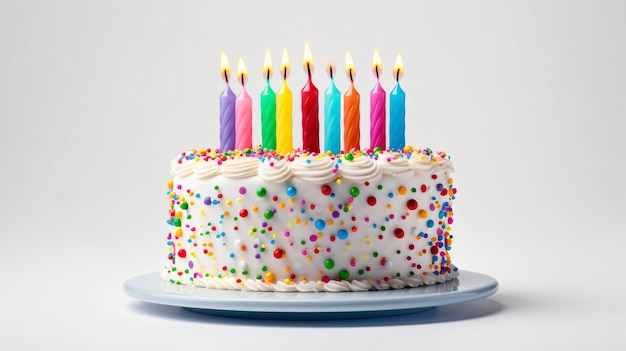
Where is `birthday candles`? birthday candles is located at coordinates (228, 108), (248, 103), (269, 101), (288, 101), (310, 92), (334, 102), (357, 109), (382, 104), (398, 108).